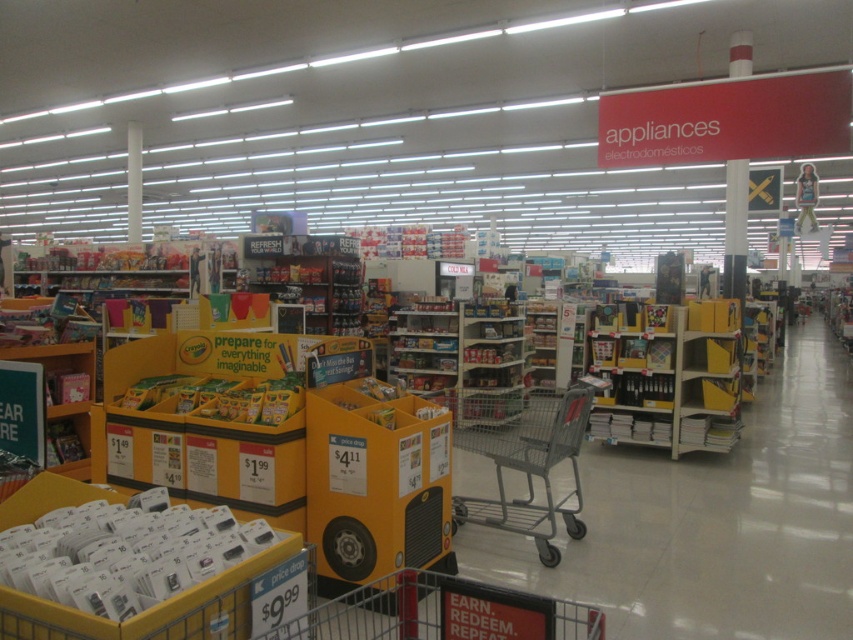
Looking at this image, you are a customer in the store and want to pick up an item from the yellow plastic shelves at center. Can you reach it while standing next to the gray metal shopping cart at center?

The gray metal shopping cart at center is located below the yellow plastic shelves at center, so the shopping cart is positioned lower. Since the shelves are above the cart, you can easily reach the item from the yellow plastic shelves at center while standing next to the gray metal shopping cart at center.

You are a customer in the store and want to move from the entrance to the appliances section. There is a gray metal shopping cart at center and yellow plastic shelves at center in your path. Can you navigate around them without moving the objects?

The gray metal shopping cart at center occupies less space than yellow plastic shelves at center, so you can navigate around them by going around the gray metal shopping cart at center which is smaller and the yellow plastic shelves at center which take up more space but still possible to go around both if there is enough space between them.

You are standing in the retail store and see the point marked at coordinates (521, 456). Based on the scene description, what object is this point located on?

The point at coordinates (521, 456) is located on the gray metal shopping cart at center.